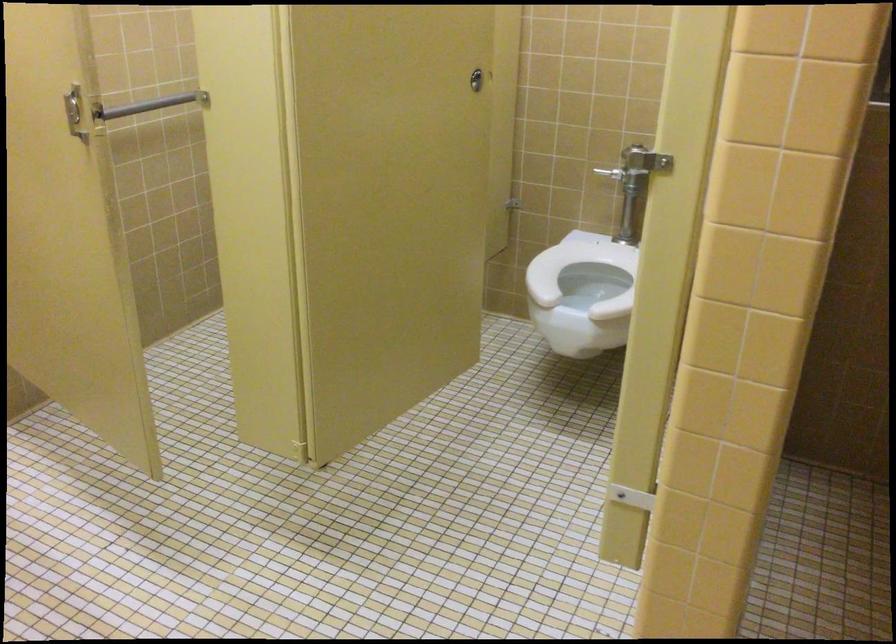
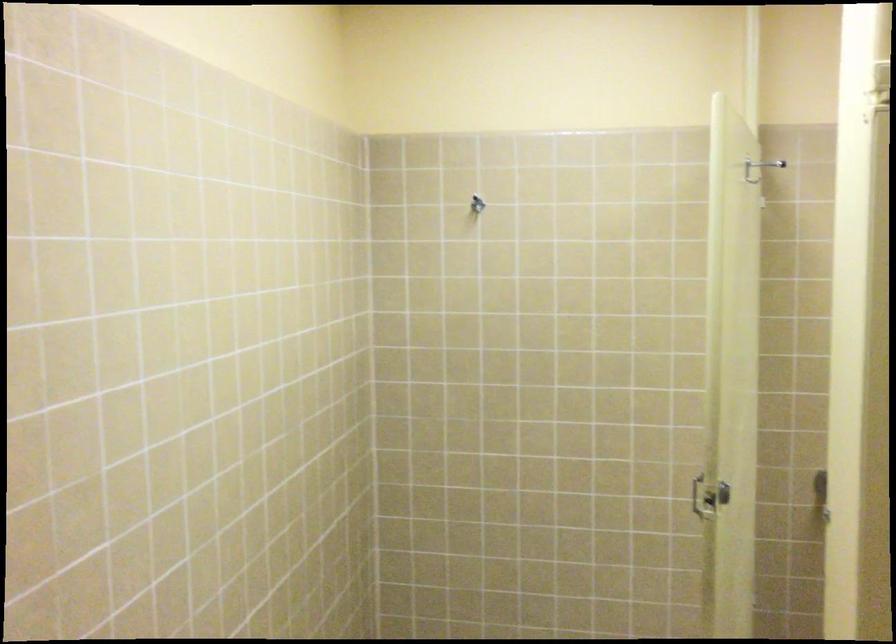
Where in the second image is the point corresponding to the point at 97,142 from the first image?

(708, 497)